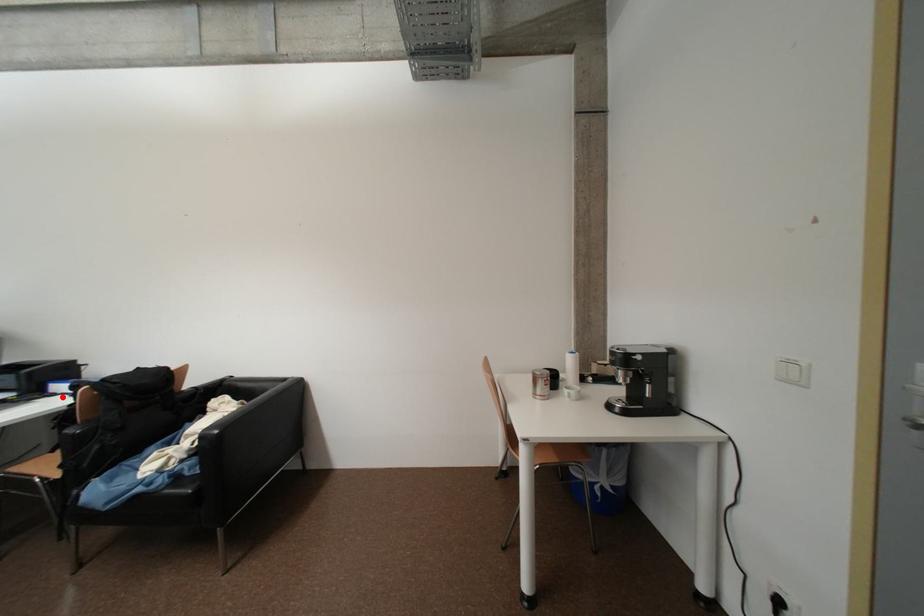
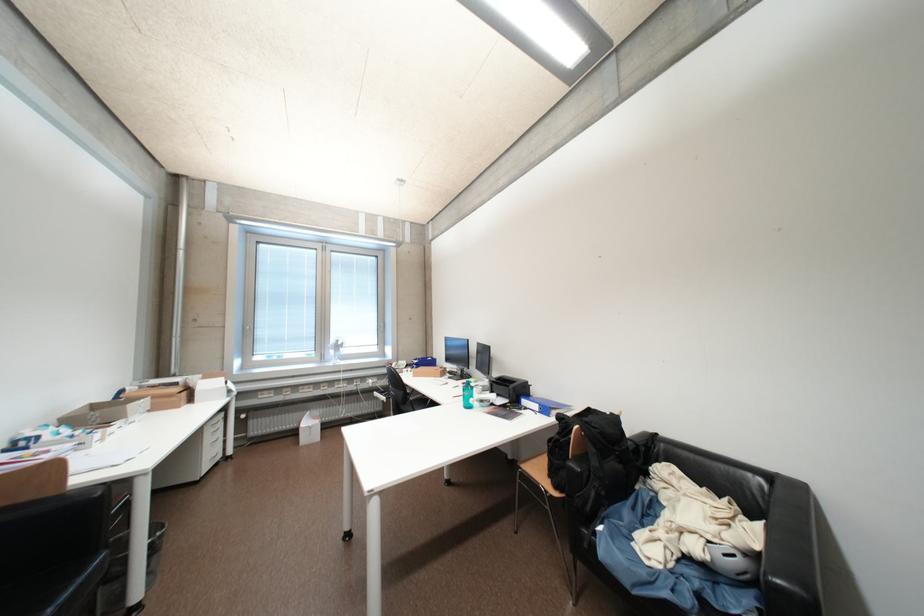
Question: A red point is marked in image1. In image2, is the corresponding 3D point closer to the camera or farther? Reply with the corresponding letter.

Choices:
 (A) The corresponding 3D point is closer.
 (B) The corresponding 3D point is farther.

Answer: (B)